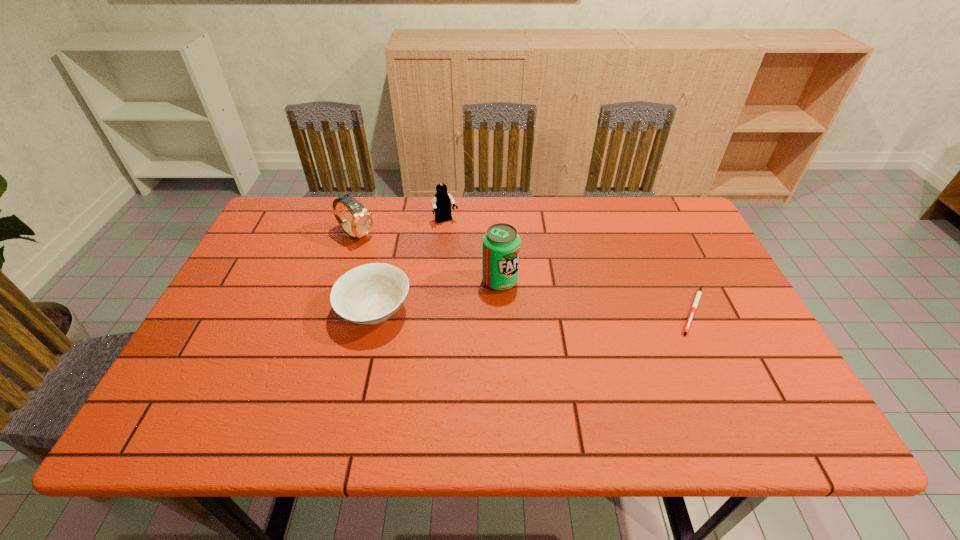
In order to click on bowl in this screenshot , I will do `click(372, 293)`.

Where is `pen`? Image resolution: width=960 pixels, height=540 pixels. pen is located at coordinates (699, 292).

Where is `the rightmost object`? The width and height of the screenshot is (960, 540). the rightmost object is located at coordinates (699, 292).

The width and height of the screenshot is (960, 540). What are the coordinates of `the second object from right to left` in the screenshot? It's located at (501, 243).

Where is `pop soda`? This screenshot has width=960, height=540. pop soda is located at coordinates (501, 243).

Locate an element on the screen. the third object from left to right is located at coordinates (441, 204).

This screenshot has width=960, height=540. I want to click on watch, so click(362, 222).

I want to click on free spot located on the right of the second shortest object, so click(456, 311).

You are a GUI agent. You are given a task and a screenshot of the screen. Output one action in this format:
    pyautogui.click(x=<x>, y=<y>)
    Task: Click on the vacant space located 0.140m on the clicker of the pen
    
    Given the screenshot: What is the action you would take?
    pyautogui.click(x=729, y=388)

You are a GUI agent. You are given a task and a screenshot of the screen. Output one action in this format:
    pyautogui.click(x=<x>, y=<y>)
    Task: Click on the vacant point located 0.150m on the front-facing side of the tallest object
    
    Given the screenshot: What is the action you would take?
    pyautogui.click(x=568, y=309)